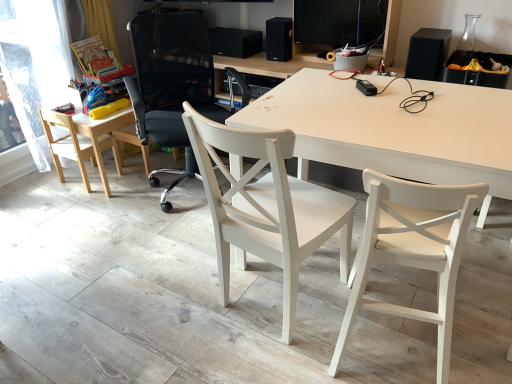
Where is `vacant space to the left of white wood chair at center, acting as the 3th chair starting from the left`? vacant space to the left of white wood chair at center, acting as the 3th chair starting from the left is located at coordinates (169, 297).